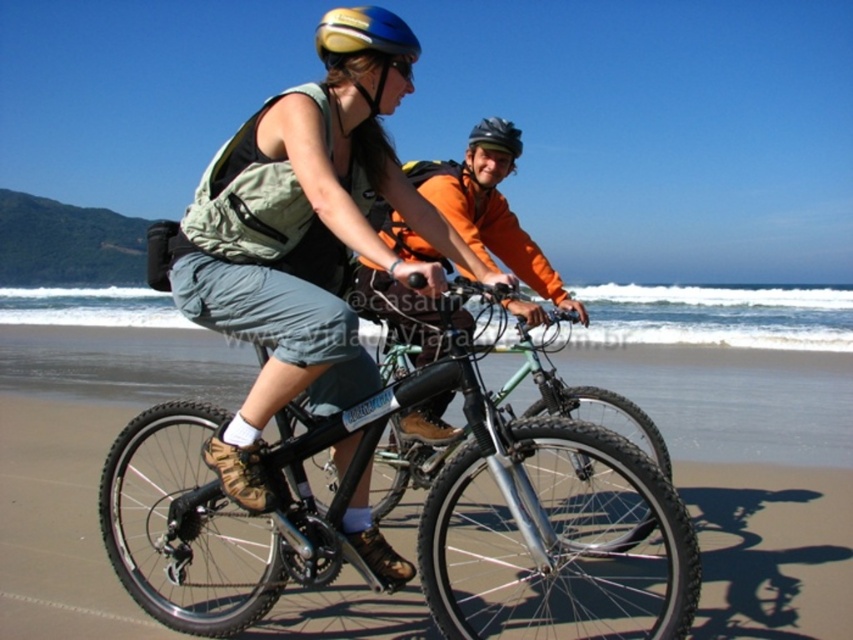
Between orange fleece jacket at center and yellow matte bicycle helmet at upper center, which one is positioned higher?

yellow matte bicycle helmet at upper center is above.

Does point (503, 196) come behind point (347, 38)?

Yes.

The width and height of the screenshot is (853, 640). Describe the element at coordinates (488, 218) in the screenshot. I see `orange fleece jacket at center` at that location.

Find the location of a particular element. The image size is (853, 640). orange fleece jacket at center is located at coordinates (488, 218).

Consider the image. Who is positioned more to the right, black matte bicycle at center or yellow matte bicycle helmet at upper center?

yellow matte bicycle helmet at upper center

Based on the photo, who is lower down, black matte bicycle at center or yellow matte bicycle helmet at upper center?

black matte bicycle at center is lower down.

Does point (229, 605) come farther from viewer compared to point (357, 22)?

That is True.

Locate an element on the screen. The width and height of the screenshot is (853, 640). black matte bicycle at center is located at coordinates coord(418,522).

Does black matte bicycle at center have a greater width compared to orange fleece jacket at center?

Yes, black matte bicycle at center is wider than orange fleece jacket at center.

Looking at this image, how distant is black matte bicycle at center from orange fleece jacket at center?

black matte bicycle at center is 4.29 feet from orange fleece jacket at center.

Identify the location of black matte bicycle at center. This screenshot has width=853, height=640. (418, 522).

Where is `black matte bicycle at center`? The width and height of the screenshot is (853, 640). black matte bicycle at center is located at coordinates (418, 522).